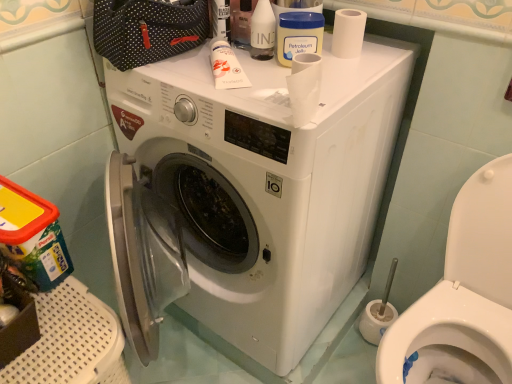
This screenshot has height=384, width=512. Find the location of `free space in front of white matte tube at upper center, which is the first toiletry from left to right`. free space in front of white matte tube at upper center, which is the first toiletry from left to right is located at coordinates (234, 96).